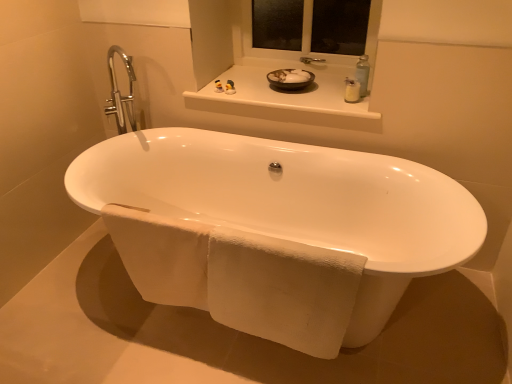
Question: Can you confirm if white glossy bowl at upper center is taller than white textured towel at lower center?

Choices:
 (A) yes
 (B) no

Answer: (B)

Question: Considering the relative sizes of white glossy bowl at upper center and white textured towel at lower center in the image provided, is white glossy bowl at upper center wider than white textured towel at lower center?

Choices:
 (A) yes
 (B) no

Answer: (A)

Question: Can you confirm if white glossy bowl at upper center is shorter than white textured towel at lower center?

Choices:
 (A) yes
 (B) no

Answer: (A)

Question: Is white glossy bowl at upper center next to white textured towel at lower center?

Choices:
 (A) no
 (B) yes

Answer: (A)

Question: Is the position of white glossy bowl at upper center less distant than that of white textured towel at lower center?

Choices:
 (A) yes
 (B) no

Answer: (B)

Question: Is point (323, 109) positioned closer to the camera than point (352, 82)?

Choices:
 (A) closer
 (B) farther

Answer: (A)

Question: Looking at the image, does white glossy window sill at upper center seem bigger or smaller compared to white plastic soap dispenser at upper right, marked as the second toiletry in a left-to-right arrangement?

Choices:
 (A) small
 (B) big

Answer: (B)

Question: From the image's perspective, is white glossy window sill at upper center located above or below white plastic soap dispenser at upper right, arranged as the first toiletry when viewed from the front?

Choices:
 (A) above
 (B) below

Answer: (A)

Question: Is white glossy window sill at upper center situated inside white plastic soap dispenser at upper right, arranged as the first toiletry when viewed from the front, or outside?

Choices:
 (A) outside
 (B) inside

Answer: (A)

Question: Is white glossy bathtub at center bigger or smaller than white glossy bowl at upper center?

Choices:
 (A) big
 (B) small

Answer: (A)

Question: Considering the positions of white glossy bathtub at center and white glossy bowl at upper center in the image, is white glossy bathtub at center taller or shorter than white glossy bowl at upper center?

Choices:
 (A) short
 (B) tall

Answer: (B)

Question: Considering their positions, is white glossy bathtub at center located in front of or behind white glossy bowl at upper center?

Choices:
 (A) behind
 (B) front

Answer: (B)

Question: From a real-world perspective, relative to white glossy bowl at upper center, is white glossy bathtub at center vertically above or below?

Choices:
 (A) above
 (B) below

Answer: (B)

Question: From the image's perspective, is white glossy bathtub at center positioned above or below white glossy window sill at upper center?

Choices:
 (A) below
 (B) above

Answer: (A)

Question: Choose the correct answer: Is white glossy bathtub at center inside white glossy window sill at upper center or outside it?

Choices:
 (A) inside
 (B) outside

Answer: (B)